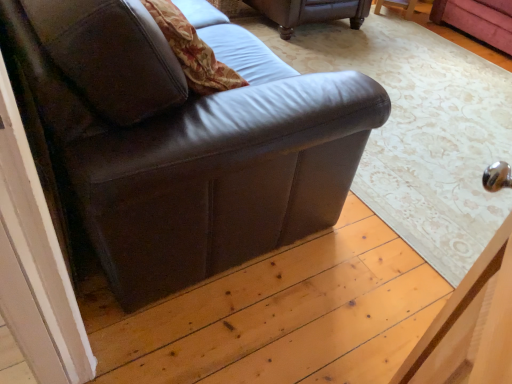
Question: Can you confirm if matte brown leather couch at left, which is the 2th studio couch from back to front, is shorter than brown leather couch at upper center, which is counted as the 1th studio couch, starting from the back?

Choices:
 (A) yes
 (B) no

Answer: (B)

Question: Is matte brown leather couch at left, which is the 2th studio couch from back to front, outside brown leather couch at upper center, which ranks as the 2th studio couch in front-to-back order?

Choices:
 (A) no
 (B) yes

Answer: (B)

Question: From a real-world perspective, is matte brown leather couch at left, the first studio couch positioned from the front, on brown leather couch at upper center, which ranks as the 2th studio couch in front-to-back order?

Choices:
 (A) no
 (B) yes

Answer: (B)

Question: Can you confirm if matte brown leather couch at left, which is the 2th studio couch from back to front, is taller than brown leather couch at upper center, which is counted as the 1th studio couch, starting from the back?

Choices:
 (A) no
 (B) yes

Answer: (B)

Question: From the image's perspective, does matte brown leather couch at left, which is the 2th studio couch from back to front, appear lower than brown leather couch at upper center, which ranks as the 2th studio couch in front-to-back order?

Choices:
 (A) yes
 (B) no

Answer: (A)

Question: Is matte brown leather couch at left, which is the 2th studio couch from back to front, to the right of brown leather couch at upper center, which is counted as the 1th studio couch, starting from the back, from the viewer's perspective?

Choices:
 (A) no
 (B) yes

Answer: (A)

Question: Is brown leather couch at upper center, which is counted as the 1th studio couch, starting from the back, turned away from matte brown leather couch at left, which is the 2th studio couch from back to front?

Choices:
 (A) yes
 (B) no

Answer: (B)

Question: Is brown leather couch at upper center, which is counted as the 1th studio couch, starting from the back, outside of matte brown leather couch at left, the first studio couch positioned from the front?

Choices:
 (A) yes
 (B) no

Answer: (A)

Question: Is brown leather couch at upper center, which ranks as the 2th studio couch in front-to-back order, closer to the viewer compared to matte brown leather couch at left, which is the 2th studio couch from back to front?

Choices:
 (A) yes
 (B) no

Answer: (B)

Question: Can you confirm if brown leather couch at upper center, which ranks as the 2th studio couch in front-to-back order, is positioned to the left of matte brown leather couch at left, which is the 2th studio couch from back to front?

Choices:
 (A) yes
 (B) no

Answer: (B)

Question: Can you confirm if brown leather couch at upper center, which is counted as the 1th studio couch, starting from the back, is smaller than matte brown leather couch at left, which is the 2th studio couch from back to front?

Choices:
 (A) no
 (B) yes

Answer: (B)

Question: Does brown leather couch at upper center, which ranks as the 2th studio couch in front-to-back order, come behind matte brown leather couch at left, the first studio couch positioned from the front?

Choices:
 (A) no
 (B) yes

Answer: (B)

Question: Do you think matte brown leather couch at left, which is the 2th studio couch from back to front, is within brown leather couch at upper center, which ranks as the 2th studio couch in front-to-back order, or outside of it?

Choices:
 (A) inside
 (B) outside

Answer: (B)